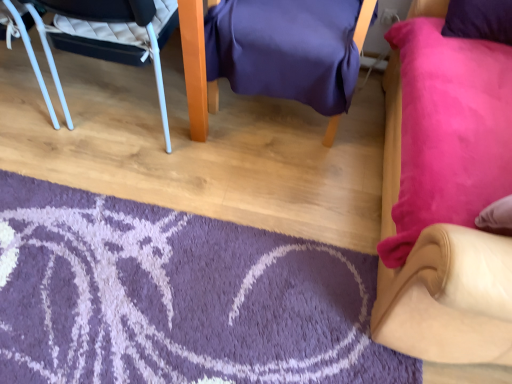
Question: Considering the positions of purple shaggy rug at lower left and suede-like beige chair at lower right, the first chair in the right-to-left sequence, in the image, is purple shaggy rug at lower left taller or shorter than suede-like beige chair at lower right, the first chair in the right-to-left sequence,?

Choices:
 (A) tall
 (B) short

Answer: (B)

Question: In terms of width, does purple shaggy rug at lower left look wider or thinner when compared to suede-like beige chair at lower right, the third chair when ordered from left to right?

Choices:
 (A) wide
 (B) thin

Answer: (B)

Question: Which object is positioned farthest from the suede-like beige chair at lower right, the third chair when ordered from left to right?

Choices:
 (A) purple shaggy rug at lower left
 (B) purple fabric chair at center, which is the 2th chair in right-to-left order
 (C) white plastic chair at left, which is the 3th chair in right-to-left order

Answer: (C)

Question: Which of these objects is positioned farthest from the suede-like beige chair at lower right, the first chair in the right-to-left sequence?

Choices:
 (A) white plastic chair at left, the 1th chair in the left-to-right sequence
 (B) purple fabric chair at center, placed as the second chair when sorted from left to right
 (C) purple shaggy rug at lower left

Answer: (A)